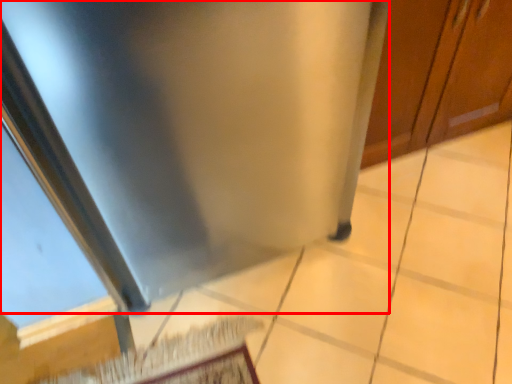
Question: From the image, what is the correct spatial relationship of stainless steel (annotated by the red box) in relation to door?

Choices:
 (A) left
 (B) right

Answer: (A)